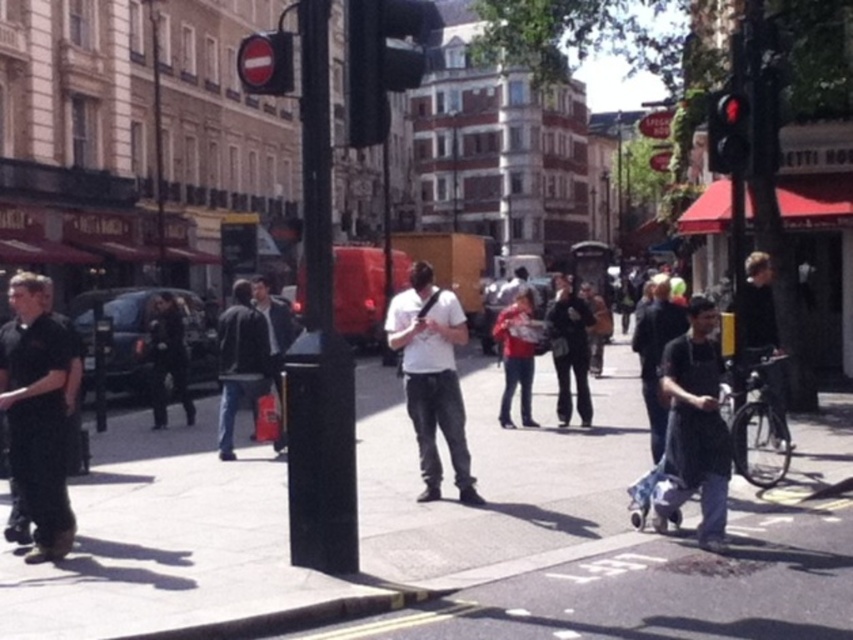
In the scene shown: Does white matte shirt at center have a greater width compared to dark blue jeans at center?

In fact, white matte shirt at center might be narrower than dark blue jeans at center.

Looking at this image, is white matte shirt at center positioned at the back of dark blue jeans at center?

Yes, white matte shirt at center is further from the viewer.

Which is behind, point (428, 276) or point (648, 300)?

The point (648, 300) is more distant.

At what (x,y) coordinates should I click in order to perform the action: click on white matte shirt at center. Please return your answer as a coordinate pair (x, y). The width and height of the screenshot is (853, 640). Looking at the image, I should click on (432, 376).

From the picture: Is black metal pole at center positioned behind black plastic traffic light at center?

No, it is not.

Is black metal pole at center bigger than black plastic traffic light at center?

No.

Is point (306, 332) farther from viewer compared to point (360, 144)?

Yes, it is behind point (360, 144).

Find the location of a particular element. This screenshot has height=640, width=853. black metal pole at center is located at coordinates (318, 344).

Is smooth concrete sidewalk at center closer to camera compared to dark blue jeans at center?

Yes, it is.

Describe the element at coordinates (442, 536) in the screenshot. I see `smooth concrete sidewalk at center` at that location.

Image resolution: width=853 pixels, height=640 pixels. What are the coordinates of `smooth concrete sidewalk at center` in the screenshot? It's located at tap(442, 536).